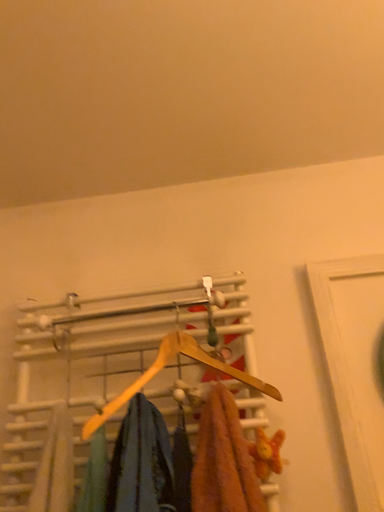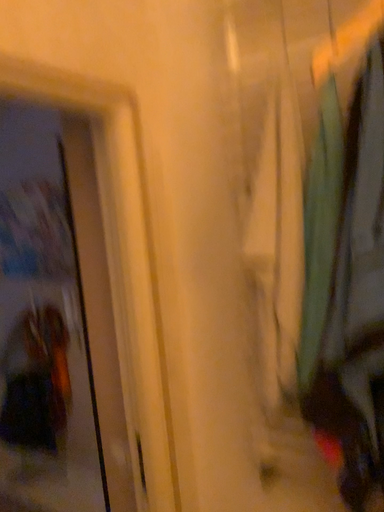
Question: Which way did the camera rotate in the video?

Choices:
 (A) rotated right
 (B) rotated left

Answer: (B)